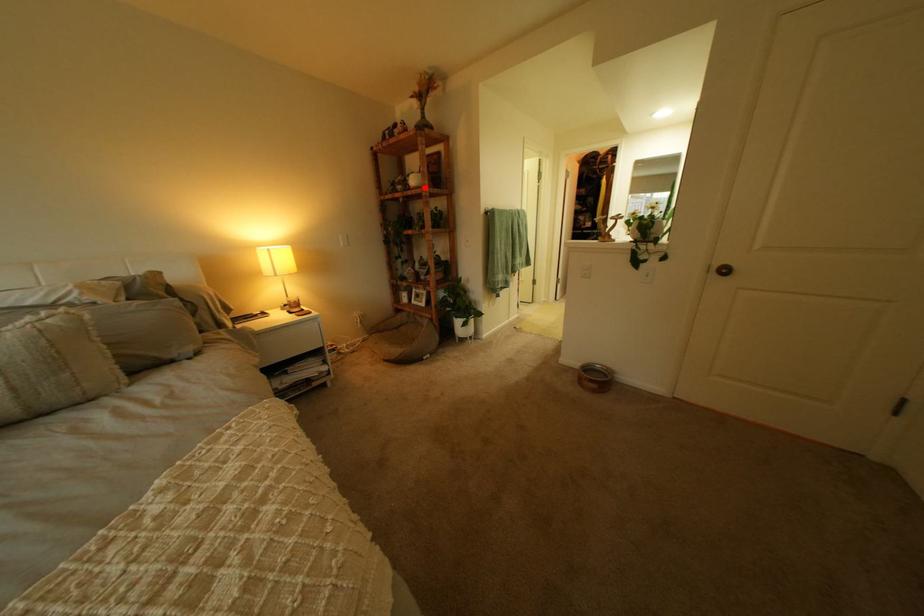
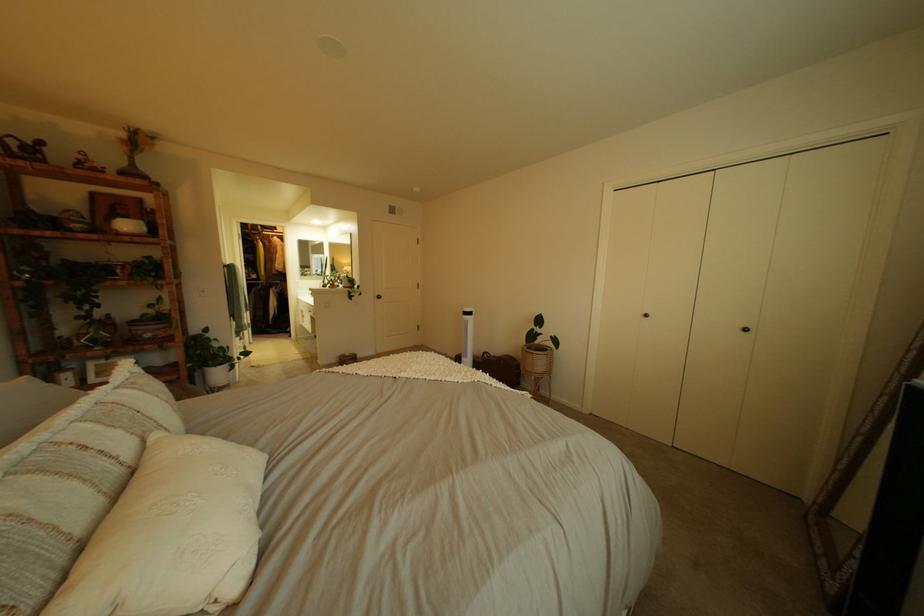
Find the pixel in the second image that matches the highlighted location in the first image.

(132, 232)